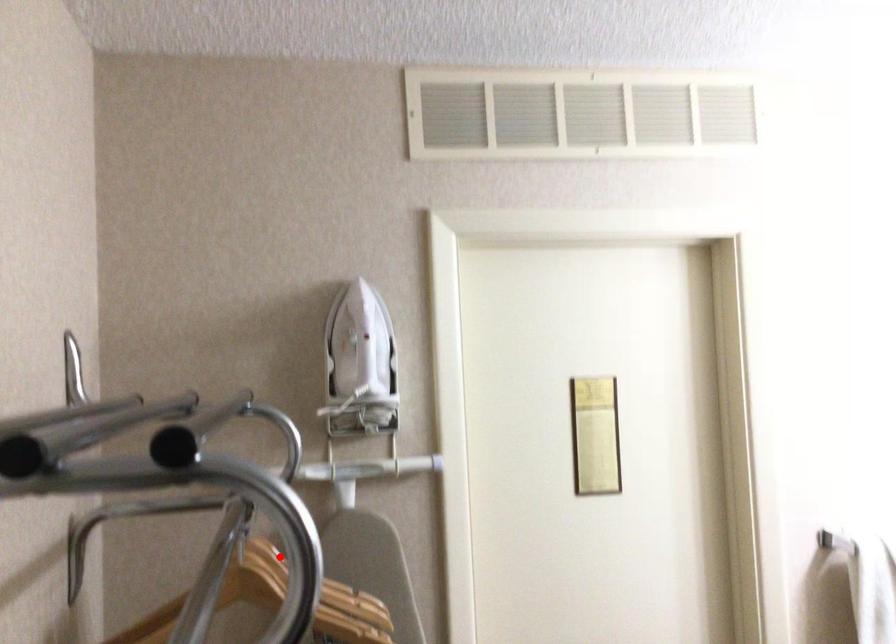
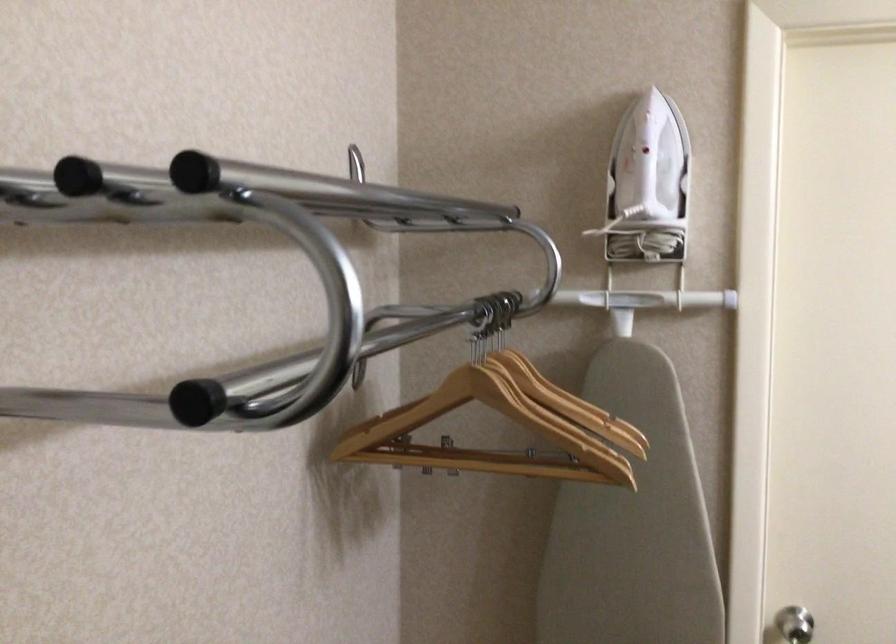
The point at the highlighted location is marked in the first image. Where is the corresponding point in the second image?

(538, 377)